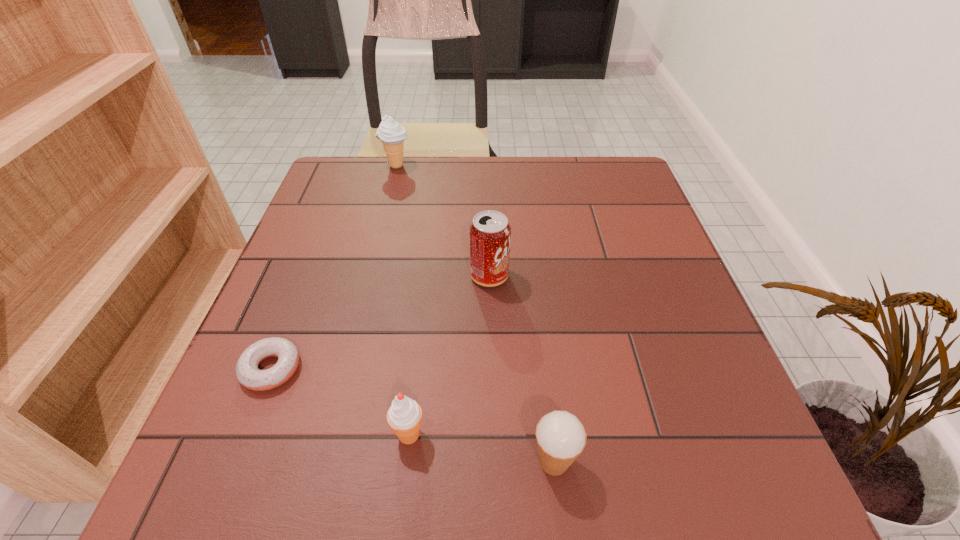
Identify the location of vacant point located between the second object from right to left and the third object from left to right. click(449, 355).

Find the location of a particular element. The image size is (960, 540). the third closest object to the third object from left to right is located at coordinates (490, 233).

Find the location of a particular element. The image size is (960, 540). object that stands as the closest to the farthest icecream is located at coordinates click(x=490, y=233).

In order to click on icecream that can be found as the closest to the soda can in this screenshot , I will do `click(404, 416)`.

Identify the location of the third closest icecream to the doughnut. (392, 135).

Where is `vacant area that satisfies the following two spatial constraints: 1. on the front side of the rightmost object; 2. on the right side of the shortest object`? This screenshot has width=960, height=540. vacant area that satisfies the following two spatial constraints: 1. on the front side of the rightmost object; 2. on the right side of the shortest object is located at coordinates (235, 462).

Image resolution: width=960 pixels, height=540 pixels. I want to click on free space that satisfies the following two spatial constraints: 1. on the back side of the soda can; 2. on the right side of the doughnut, so click(x=308, y=276).

I want to click on blank area in the image that satisfies the following two spatial constraints: 1. on the back side of the leftmost object; 2. on the left side of the second farthest object, so click(x=308, y=276).

This screenshot has height=540, width=960. Identify the location of free space that satisfies the following two spatial constraints: 1. on the front side of the doughnut; 2. on the right side of the rightmost object. (235, 462).

The width and height of the screenshot is (960, 540). Identify the location of vacant space that satisfies the following two spatial constraints: 1. on the front side of the rightmost icecream; 2. on the left side of the shortest object. pyautogui.click(x=235, y=462).